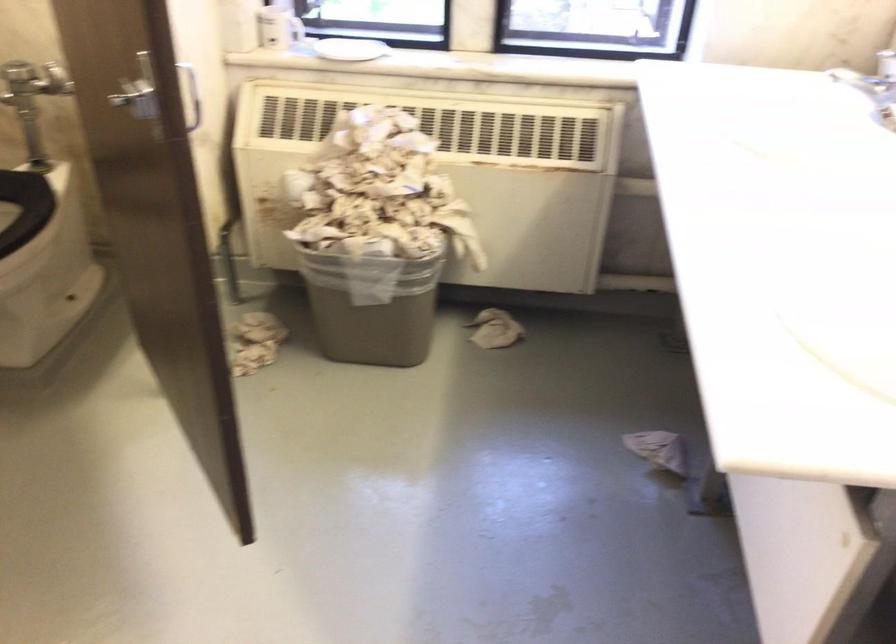
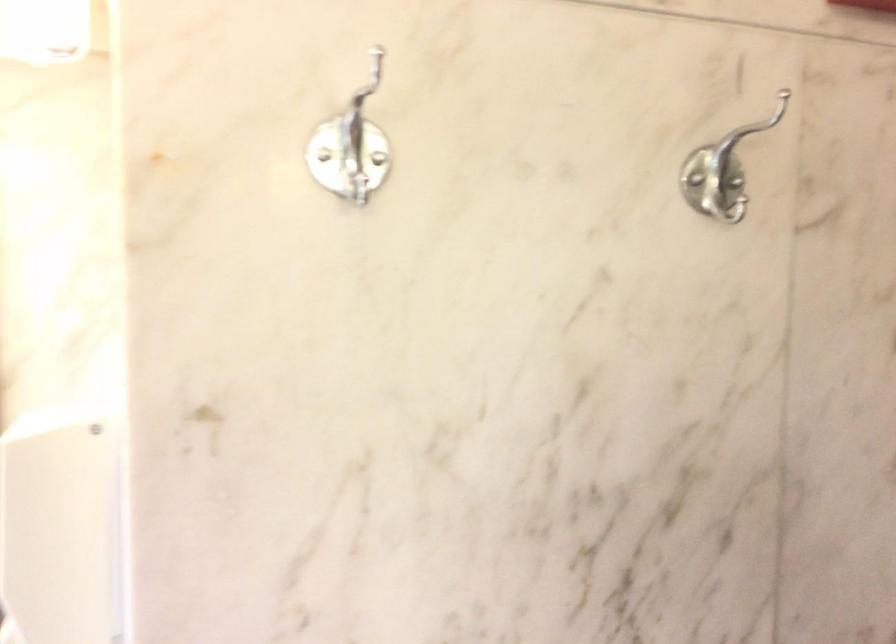
The first image is from the beginning of the video and the second image is from the end. How did the camera likely rotate when shooting the video?

The rotation direction of the camera is right-down.